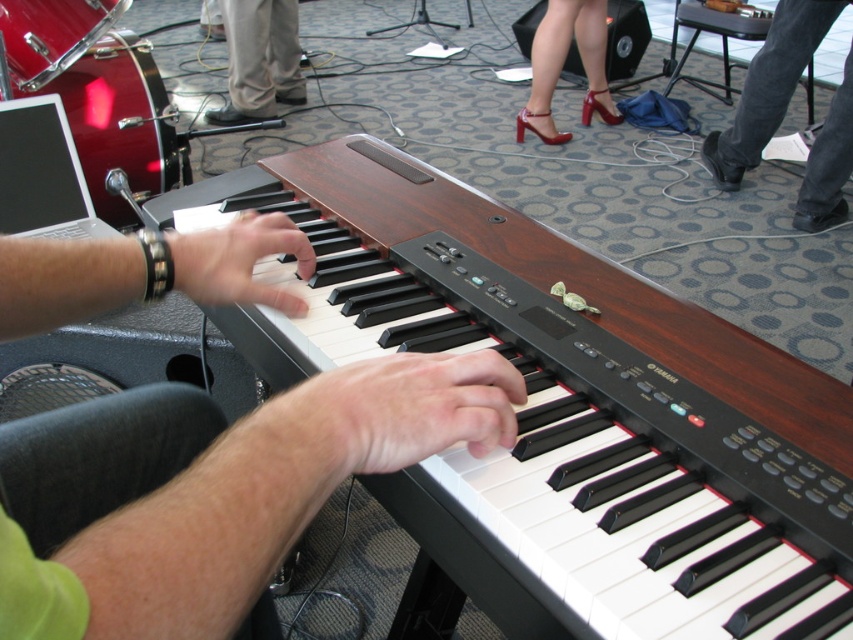
You are a stagehand setting up for a performance. You need to place a new microphone stand between the black leather shoe at lower right and the shiny patent leather high heels at upper center. Based on their positions, where should you position the microphone stand?

The black leather shoe at lower right is below the shiny patent leather high heels at upper center, so the microphone stand should be placed between them vertically, positioning it above the black leather shoe at lower right and below the shiny patent leather high heels at upper center.

You are standing on the stage where the Yamaha keyboard is placed. There is a point at coordinate (769, 88). What object is located at that point?

The point at coordinate (769, 88) is located on the black leather shoe at lower right.